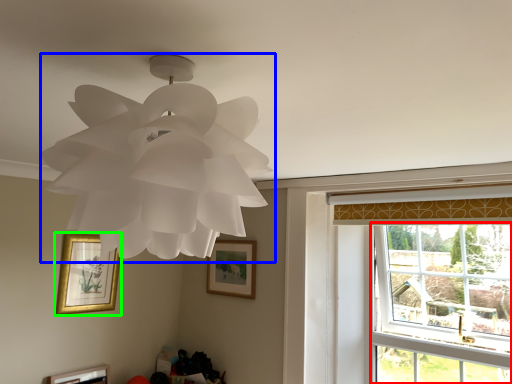
Question: Based on their relative distances, which object is nearer to window (highlighted by a red box)? Choose from lamp (highlighted by a blue box) and picture frame (highlighted by a green box).

Choices:
 (A) lamp
 (B) picture frame

Answer: (B)